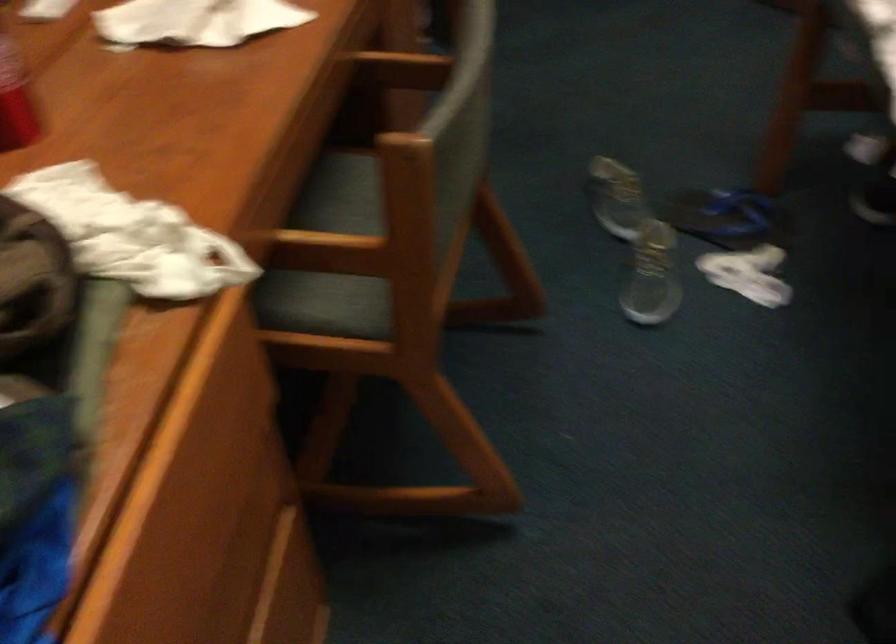
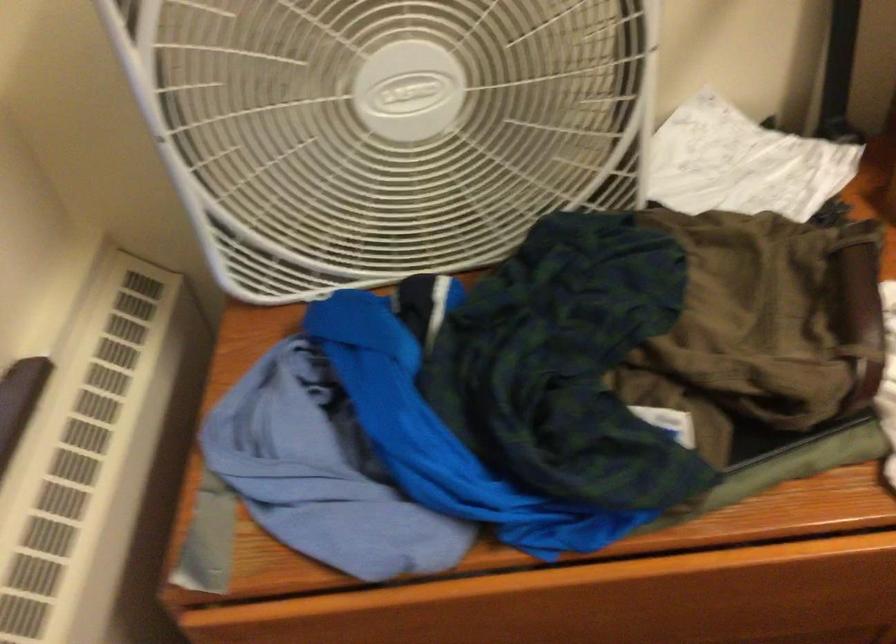
Based on the photo, the images are taken continuously from a first-person perspective. In which direction is your viewpoint rotating?

The camera rotated toward left-down.